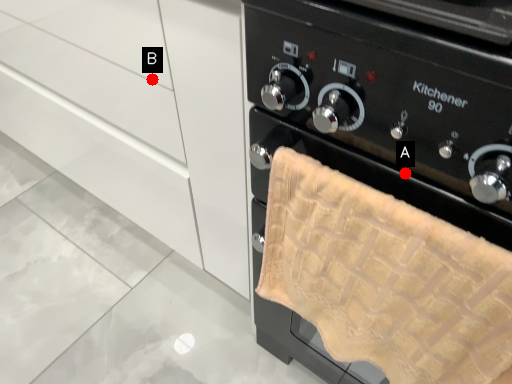
Question: Two points are circled on the image, labeled by A and B beside each circle. Which point is closer to the camera?

Choices:
 (A) A is closer
 (B) B is closer

Answer: (A)